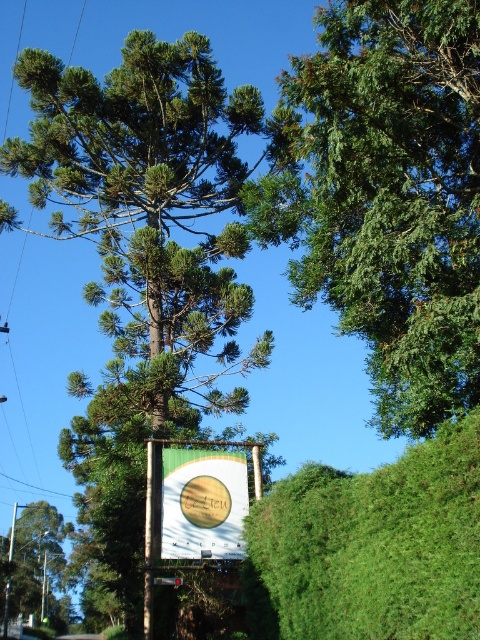
Question: Which object appears farthest from the camera in this image?

Choices:
 (A) green fabric sign at center
 (B) green leafy tree at left
 (C) green leafy hedge at lower right
 (D) green matte sign at center

Answer: (B)

Question: Does green needle-like at upper center come behind green matte sign at center?

Choices:
 (A) no
 (B) yes

Answer: (A)

Question: Does green needle-like at upper center appear on the left side of green fabric sign at center?

Choices:
 (A) yes
 (B) no

Answer: (B)

Question: Which object appears farthest from the camera in this image?

Choices:
 (A) green textured tree at center
 (B) green needle-like at upper center
 (C) green leafy hedge at lower right

Answer: (A)

Question: Which point is closer to the camera?

Choices:
 (A) (190, 520)
 (B) (156, 582)
 (C) (420, 580)
 (D) (9, 586)

Answer: (C)

Question: Is green textured tree at center wider than green leafy tree at left?

Choices:
 (A) yes
 (B) no

Answer: (A)